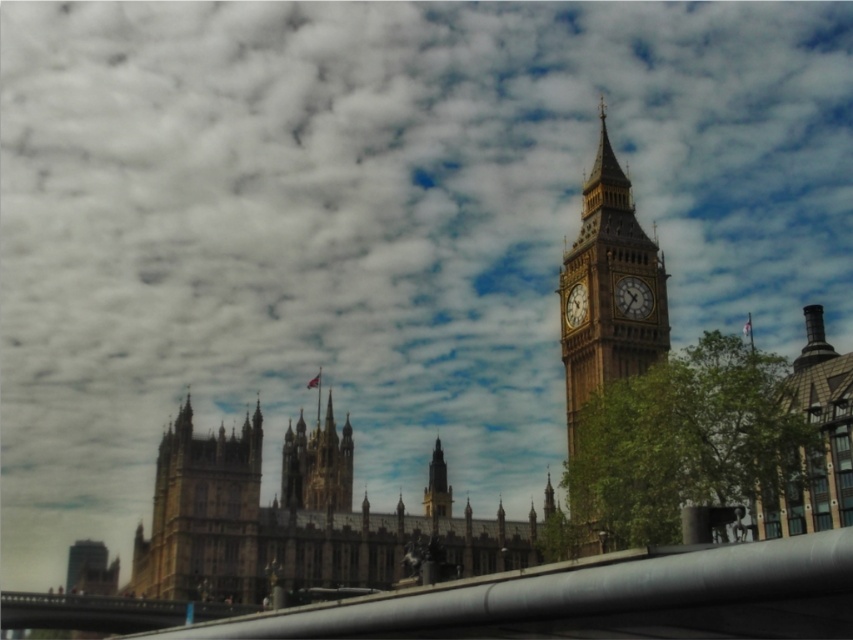
Question: From the image, what is the correct spatial relationship of brown stone building at center in relation to gold metallic clock at right?

Choices:
 (A) right
 (B) left

Answer: (B)

Question: Which object appears farthest from the camera in this image?

Choices:
 (A) brown stone clock tower at right
 (B) gold metallic clock at right
 (C) gold textured clock at upper right

Answer: (B)

Question: Does brown stone building at right lie in front of gold metallic clock at right?

Choices:
 (A) no
 (B) yes

Answer: (B)

Question: Which is farther from the gold textured clock at upper right?

Choices:
 (A) brown stone building at center
 (B) gold metallic clock at right
 (C) brown stone building at right

Answer: (A)

Question: Is gold textured clock at upper right above gold metallic clock at right?

Choices:
 (A) no
 (B) yes

Answer: (A)

Question: Which object appears farthest from the camera in this image?

Choices:
 (A) brown stone clock tower at right
 (B) gold textured clock at upper right
 (C) brown stone building at right

Answer: (B)